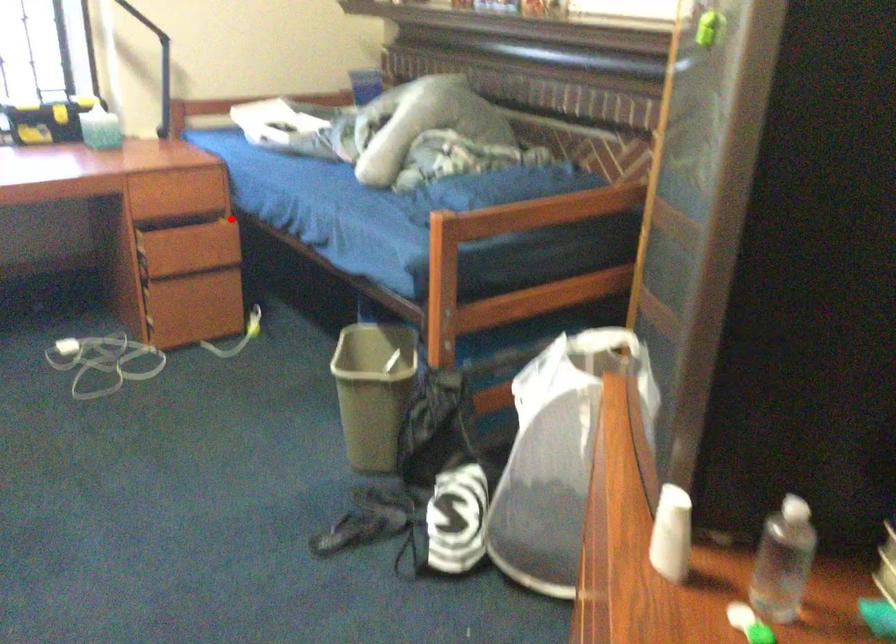
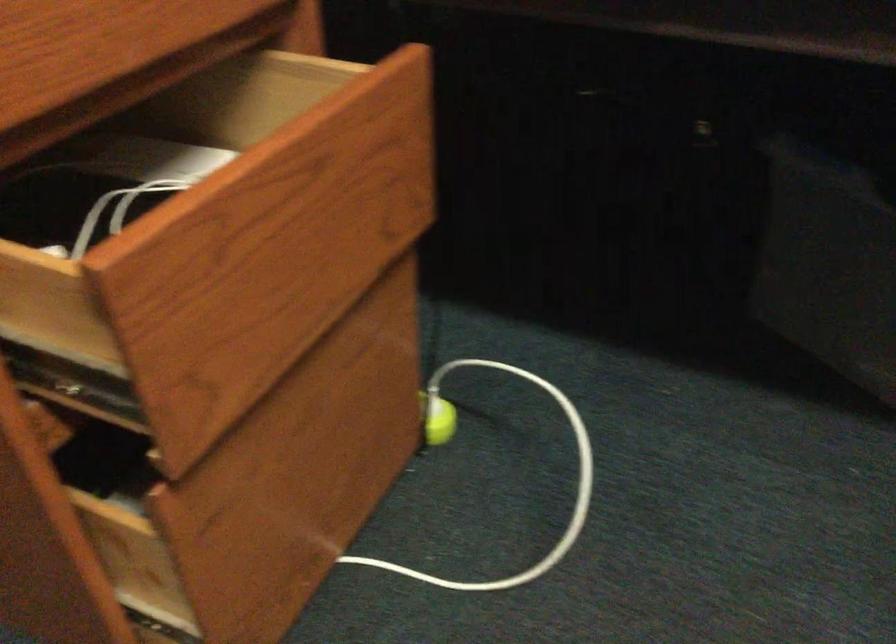
In the second image, find the point that corresponds to the highlighted location in the first image.

(323, 62)